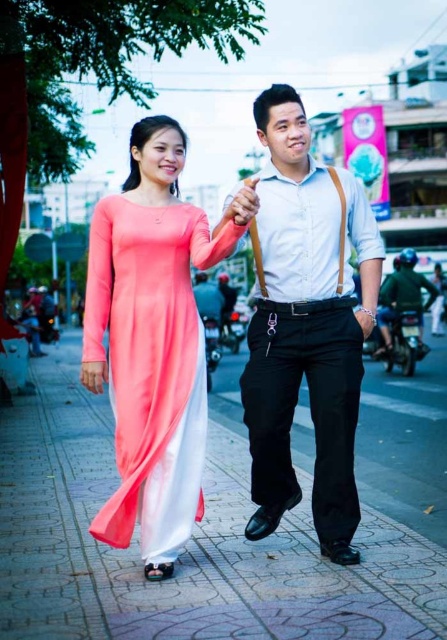
You are a pedestrian standing at the point with coordinates (223, 522). Looking around, you see a woman in a pink ao dai on the left and a man in a light blue shirt on the right. Which direction should you walk to reach the smooth concrete pavement at center?

The point (223, 522) is already at the center, so you are already standing on the smooth concrete pavement at center. No need to walk further.

Based on the photo, you are a photographer planning to capture a wide shot of the scene. The camera you are using has a maximum width capacity of 2 meters. Given that the smooth concrete pavement at center is wider than the coral satin ao dai at center, can you fit both objects within the camera frame?

The smooth concrete pavement at center is wider than the coral satin ao dai at center. Since the camera can capture up to 2 meters in width, and the pavement is the wider object, as long as the pavement itself is within the 2 meters width limit, both objects can be included. However, if the pavement exceeds 2 meters, then it might not fit. The description only states the pavement is wider than the ao dai but doesn

You are a photographer standing behind the two people in the image. You want to capture a photo of the smooth concrete pavement at center without any obstruction from the matte black pants at center. Is the pavement visible underneath the pants?

The smooth concrete pavement at center is positioned under matte black pants at center, so the pavement is visible underneath the pants.